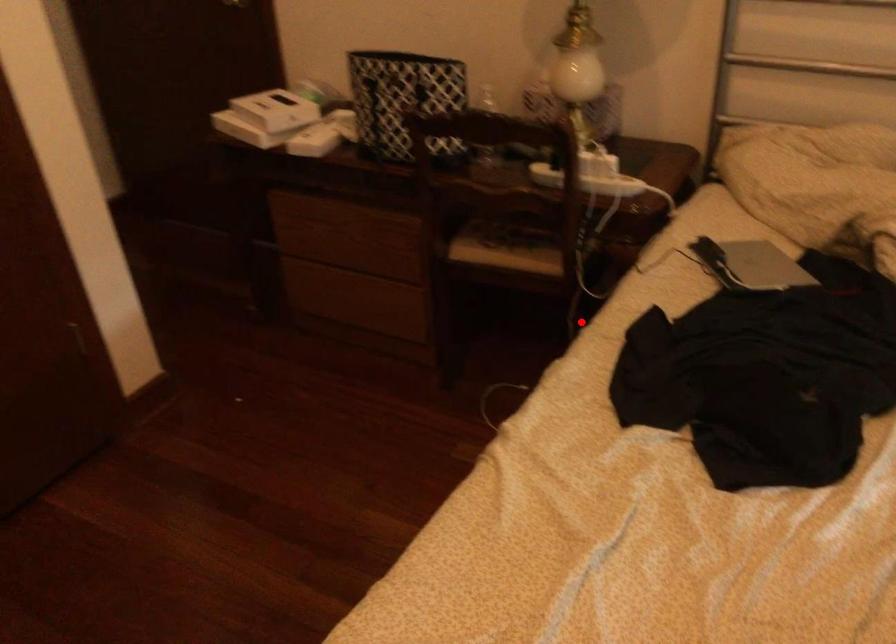
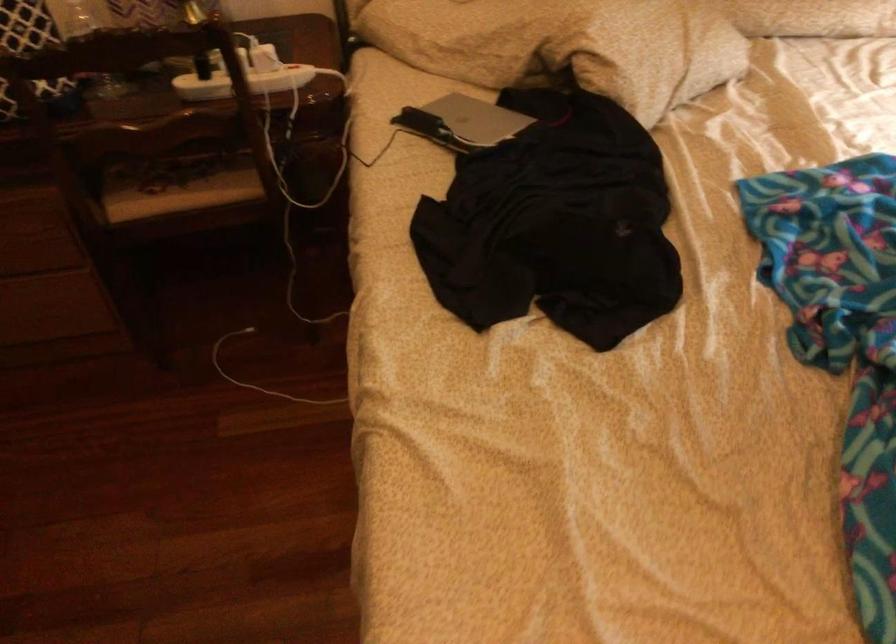
Find the pixel in the second image that matches the highlighted location in the first image.

(291, 240)